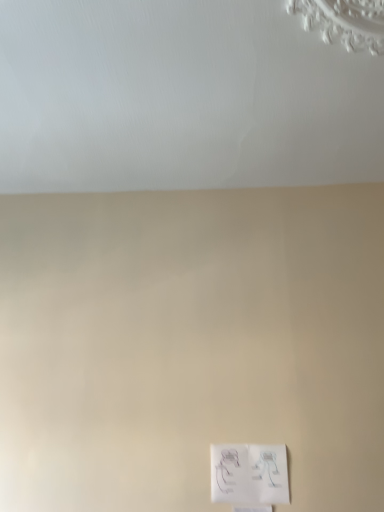
Question: Should I look upward or downward to see white paper at lower center?

Choices:
 (A) up
 (B) down

Answer: (B)

Question: Is white matte ceiling at upper center located outside white paper at lower center?

Choices:
 (A) yes
 (B) no

Answer: (A)

Question: Is the surface of white matte ceiling at upper center in direct contact with white paper at lower center?

Choices:
 (A) no
 (B) yes

Answer: (A)

Question: Does white matte ceiling at upper center have a greater width compared to white paper at lower center?

Choices:
 (A) yes
 (B) no

Answer: (A)

Question: Can you confirm if white matte ceiling at upper center is smaller than white paper at lower center?

Choices:
 (A) yes
 (B) no

Answer: (B)

Question: From a real-world perspective, is white matte ceiling at upper center below white paper at lower center?

Choices:
 (A) no
 (B) yes

Answer: (A)

Question: From the image's perspective, is white matte ceiling at upper center below white paper at lower center?

Choices:
 (A) yes
 (B) no

Answer: (B)

Question: Would you say white paper at lower center is a long distance from white matte ceiling at upper center?

Choices:
 (A) no
 (B) yes

Answer: (B)

Question: Is the position of white paper at lower center less distant than that of white matte ceiling at upper center?

Choices:
 (A) yes
 (B) no

Answer: (B)

Question: Is white paper at lower center touching white matte ceiling at upper center?

Choices:
 (A) yes
 (B) no

Answer: (B)

Question: From a real-world perspective, is white paper at lower center over white matte ceiling at upper center?

Choices:
 (A) yes
 (B) no

Answer: (B)

Question: Can you confirm if white paper at lower center is taller than white matte ceiling at upper center?

Choices:
 (A) yes
 (B) no

Answer: (A)

Question: Is white paper at lower center behind white matte ceiling at upper center?

Choices:
 (A) no
 (B) yes

Answer: (B)

Question: Considering the positions of white matte ceiling at upper center and white paper at lower center in the image, is white matte ceiling at upper center taller or shorter than white paper at lower center?

Choices:
 (A) short
 (B) tall

Answer: (A)